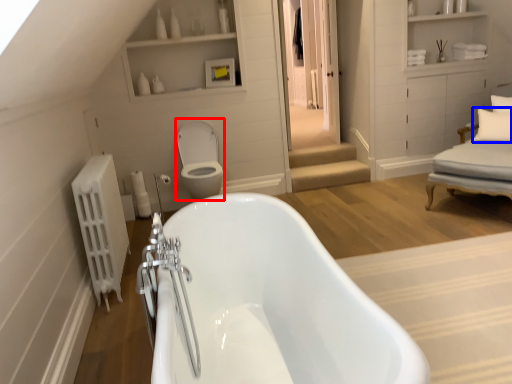
Question: Which point is closer to the camera, toilet bowl (highlighted by a red box) or pillow (highlighted by a blue box)?

Choices:
 (A) toilet bowl
 (B) pillow

Answer: (A)